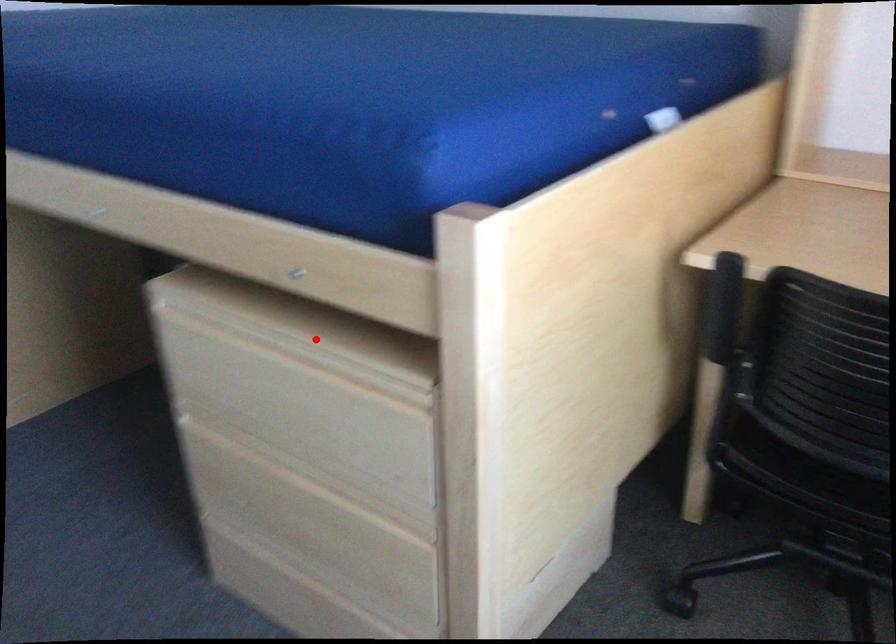
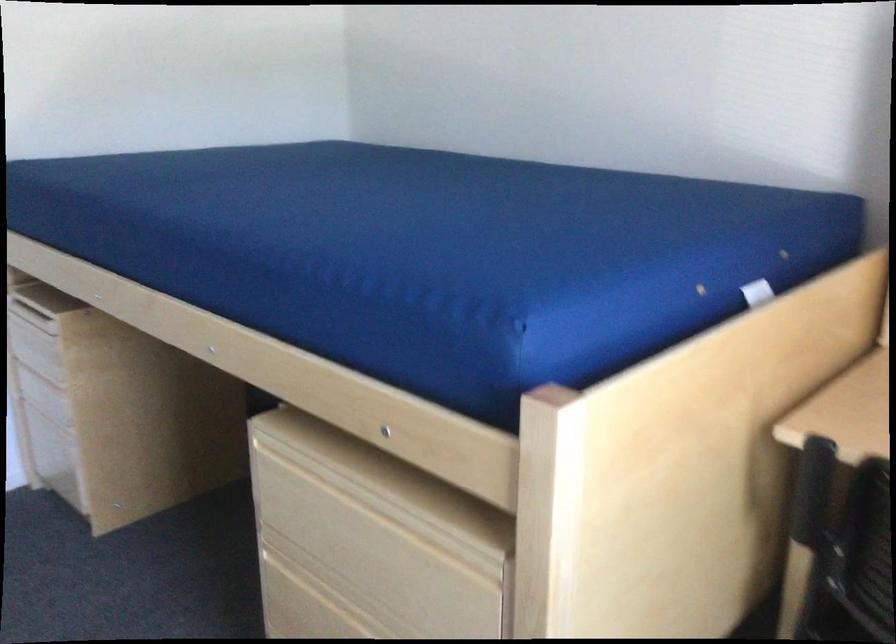
Where in the second image is the point corresponding to the highlighted location from the first image?

(397, 491)